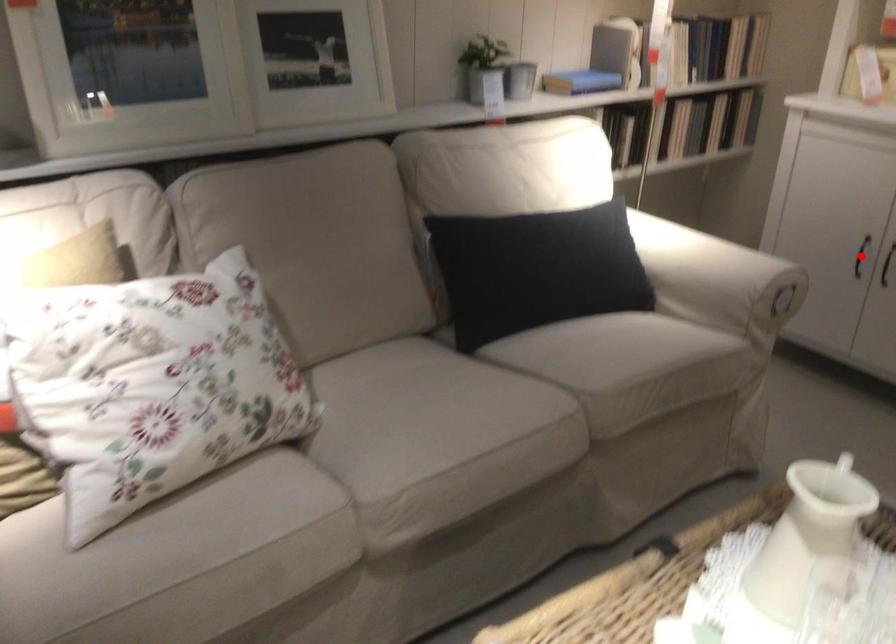
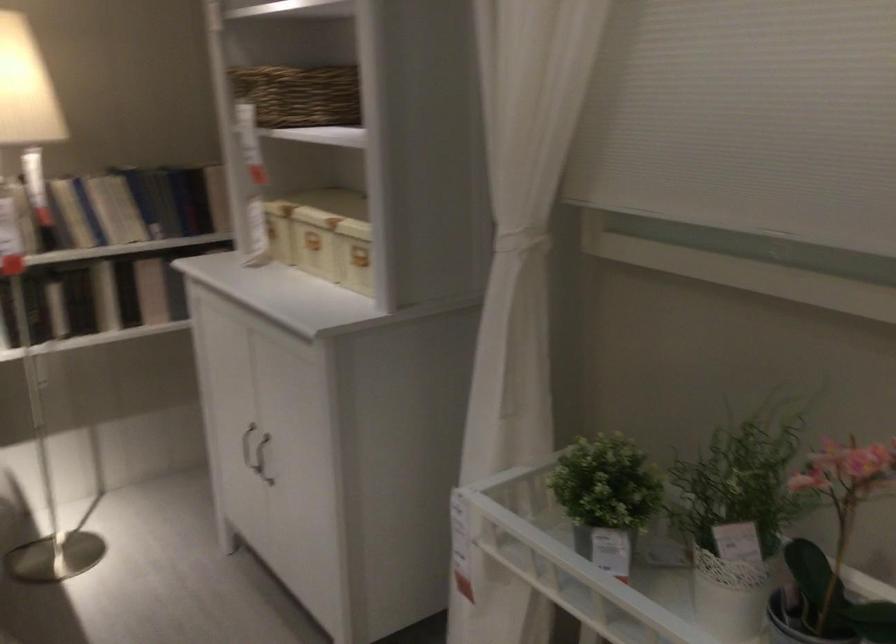
Question: I am providing you with two images of the same scene from different viewpoints. A red point is marked on the first image. At the location where the point appears in image 1, is it still visible in image 2?

Choices:
 (A) Yes
 (B) No

Answer: (B)